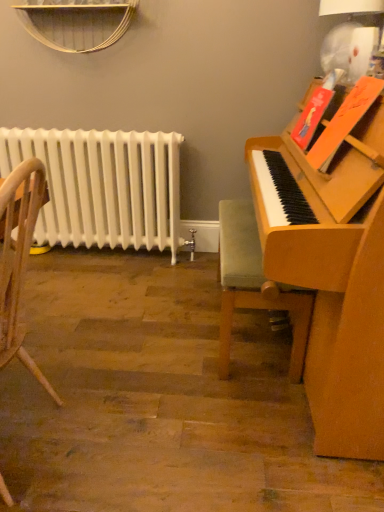
Question: Does wooden chair at left, the 1th chair when ordered from left to right, appear on the left side of white painted metal radiator at left?

Choices:
 (A) no
 (B) yes

Answer: (A)

Question: From the image's perspective, does wooden chair at left, which appears as the second chair when viewed from the right, appear lower than white painted metal radiator at left?

Choices:
 (A) no
 (B) yes

Answer: (B)

Question: From a real-world perspective, is wooden chair at left, arranged as the first chair when viewed from the front, below white painted metal radiator at left?

Choices:
 (A) no
 (B) yes

Answer: (A)

Question: Is white painted metal radiator at left completely or partially inside wooden chair at left, arranged as the first chair when viewed from the front?

Choices:
 (A) yes
 (B) no

Answer: (B)

Question: From the image's perspective, would you say wooden chair at left, arranged as the first chair when viewed from the front, is positioned over white painted metal radiator at left?

Choices:
 (A) yes
 (B) no

Answer: (B)

Question: Considering the positions of velvet green cushioned chair at right, the 1th chair viewed from the right, and wooden chair at left, which appears as the second chair when viewed from the right, in the image, is velvet green cushioned chair at right, the 1th chair viewed from the right, taller or shorter than wooden chair at left, which appears as the second chair when viewed from the right,?

Choices:
 (A) tall
 (B) short

Answer: (B)

Question: Based on their sizes in the image, would you say velvet green cushioned chair at right, the first chair in the back-to-front sequence, is bigger or smaller than wooden chair at left, which is counted as the second chair, starting from the back?

Choices:
 (A) small
 (B) big

Answer: (A)

Question: Based on their positions, is velvet green cushioned chair at right, which is counted as the second chair, starting from the left, located to the left or right of wooden chair at left, arranged as the first chair when viewed from the front?

Choices:
 (A) left
 (B) right

Answer: (B)

Question: Is velvet green cushioned chair at right, the first chair in the back-to-front sequence, in front of or behind wooden chair at left, which is counted as the second chair, starting from the back, in the image?

Choices:
 (A) behind
 (B) front

Answer: (A)

Question: Is wooden chair at left, the 1th chair when ordered from left to right, wider or thinner than white painted metal radiator at left?

Choices:
 (A) wide
 (B) thin

Answer: (A)

Question: Is point (21, 226) positioned closer to the camera than point (122, 223)?

Choices:
 (A) closer
 (B) farther

Answer: (A)

Question: From their relative heights in the image, would you say wooden chair at left, arranged as the first chair when viewed from the front, is taller or shorter than white painted metal radiator at left?

Choices:
 (A) tall
 (B) short

Answer: (A)

Question: In the image, is wooden chair at left, arranged as the first chair when viewed from the front, on the left side or the right side of white painted metal radiator at left?

Choices:
 (A) left
 (B) right

Answer: (B)

Question: Is velvet green cushioned chair at right, the 1th chair viewed from the right, taller or shorter than white painted metal radiator at left?

Choices:
 (A) short
 (B) tall

Answer: (A)

Question: From a real-world perspective, is velvet green cushioned chair at right, which is counted as the second chair, starting from the left, above or below white painted metal radiator at left?

Choices:
 (A) below
 (B) above

Answer: (A)